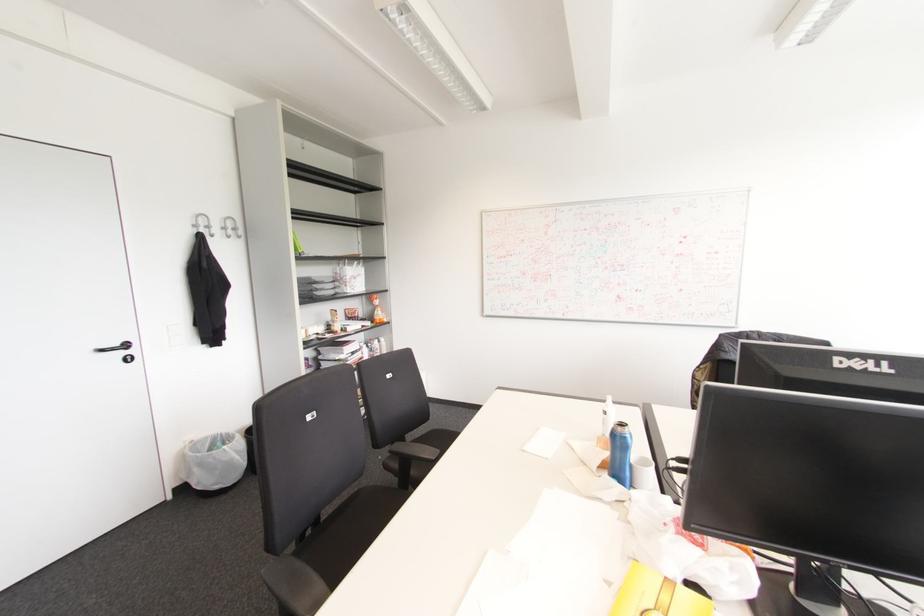
Which object does [642,474] point to?

It refers to a white ceramic cup.